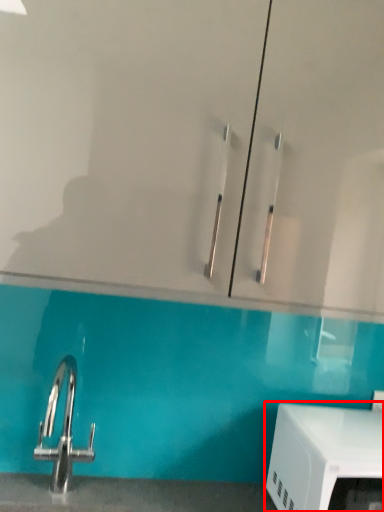
Question: From the image's perspective, what is the correct spatial positioning of appliance (annotated by the red box) in reference to glass door?

Choices:
 (A) above
 (B) below

Answer: (B)